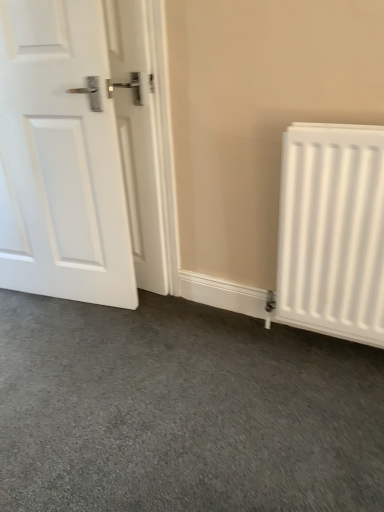
Question: Does white matte door at left have a smaller size compared to white matte radiator at right?

Choices:
 (A) no
 (B) yes

Answer: (A)

Question: Is white matte door at left positioned in front of white matte radiator at right?

Choices:
 (A) yes
 (B) no

Answer: (B)

Question: Is white matte door at left touching white matte radiator at right?

Choices:
 (A) no
 (B) yes

Answer: (A)

Question: From the image's perspective, does white matte door at left appear lower than white matte radiator at right?

Choices:
 (A) no
 (B) yes

Answer: (A)

Question: From a real-world perspective, is white matte door at left on white matte radiator at right?

Choices:
 (A) yes
 (B) no

Answer: (A)

Question: Considering the relative sizes of white matte door at left and white matte radiator at right in the image provided, is white matte door at left wider than white matte radiator at right?

Choices:
 (A) no
 (B) yes

Answer: (B)

Question: From the image's perspective, does white matte radiator at right appear higher than white matte door at left?

Choices:
 (A) yes
 (B) no

Answer: (B)

Question: From a real-world perspective, is white matte radiator at right located beneath white matte door at left?

Choices:
 (A) yes
 (B) no

Answer: (A)

Question: Is white matte radiator at right positioned behind white matte door at left?

Choices:
 (A) no
 (B) yes

Answer: (A)

Question: Is white matte radiator at right turned away from white matte door at left?

Choices:
 (A) yes
 (B) no

Answer: (B)

Question: Is white matte door at left a part of white matte radiator at right?

Choices:
 (A) no
 (B) yes

Answer: (A)

Question: Is white matte radiator at right smaller than white matte door at left?

Choices:
 (A) yes
 (B) no

Answer: (A)

Question: Is point pyautogui.click(x=16, y=257) positioned closer to the camera than point pyautogui.click(x=380, y=172)?

Choices:
 (A) closer
 (B) farther

Answer: (B)